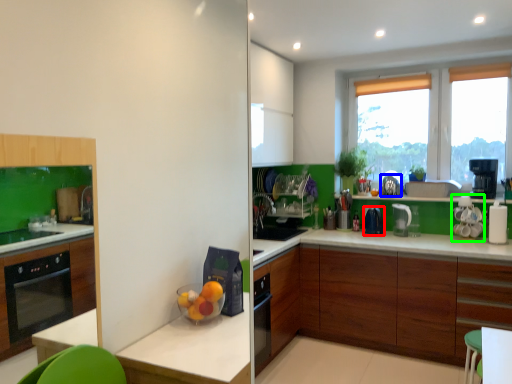
Question: Which object is positioned farthest from kitchen appliance (highlighted by a red box)? Select from appliance (highlighted by a blue box) and appliance (highlighted by a green box).

Choices:
 (A) appliance
 (B) appliance

Answer: (B)